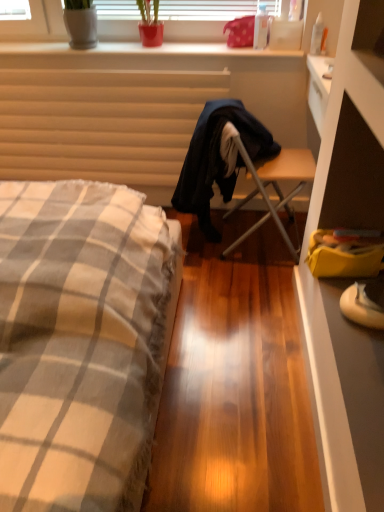
Where is `free space above matte beige radiator at upper left (from a real-world perspective)`? free space above matte beige radiator at upper left (from a real-world perspective) is located at coordinates (91, 65).